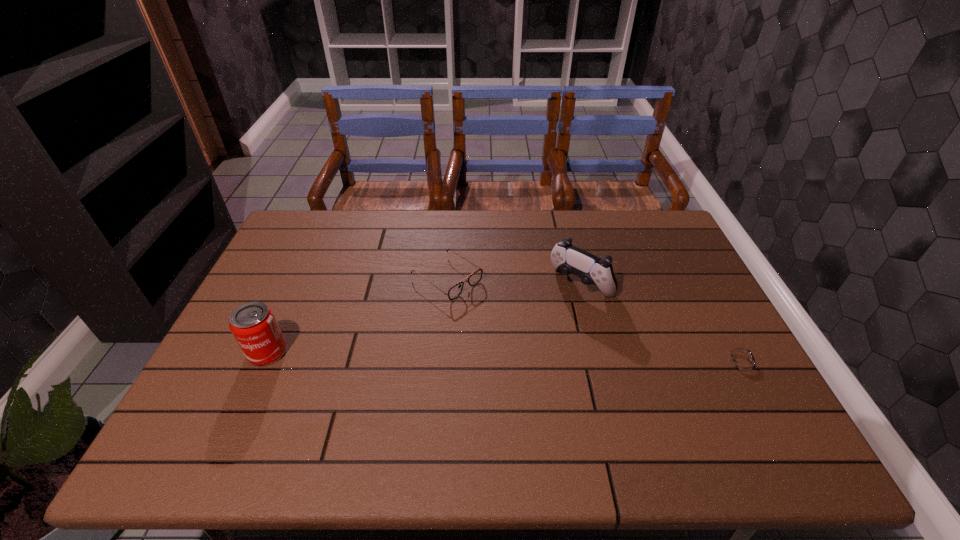
Locate an element on the screen. The image size is (960, 540). vacant space that's between the shortest object and the control is located at coordinates (660, 322).

Where is `empty location between the second object from left to right and the second object from right to left`? Image resolution: width=960 pixels, height=540 pixels. empty location between the second object from left to right and the second object from right to left is located at coordinates (514, 281).

Locate an element on the screen. Image resolution: width=960 pixels, height=540 pixels. free space between the leftmost object and the third object from left to right is located at coordinates (424, 319).

Find the location of a particular element. The width and height of the screenshot is (960, 540). free space between the second object from left to right and the leftmost object is located at coordinates (357, 315).

The image size is (960, 540). I want to click on free space between the leftmost object and the shortest object, so click(504, 356).

The width and height of the screenshot is (960, 540). I want to click on free spot between the leftmost object and the second object from right to left, so click(x=424, y=319).

The height and width of the screenshot is (540, 960). Identify the location of vacant area that lies between the sunglasses and the leftmost object. (357, 315).

Image resolution: width=960 pixels, height=540 pixels. Find the location of `empty location between the can and the second object from left to right`. empty location between the can and the second object from left to right is located at coordinates (357, 315).

Image resolution: width=960 pixels, height=540 pixels. Identify the location of vacant region between the leftmost object and the control. (424, 319).

Find the location of `free space between the leftmost object and the shortest object`. free space between the leftmost object and the shortest object is located at coordinates 504,356.